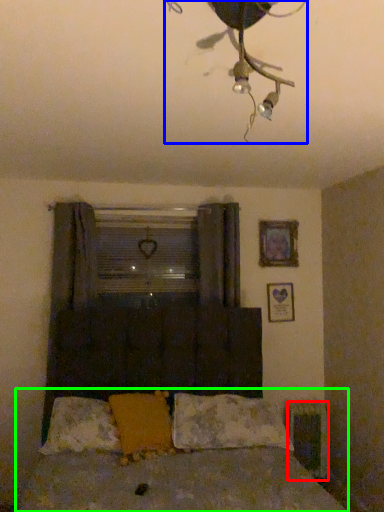
Question: Based on their relative distances, which object is nearer to radiator (highlighted by a red box)? Choose from lamp (highlighted by a blue box) and bed (highlighted by a green box).

Choices:
 (A) lamp
 (B) bed

Answer: (B)